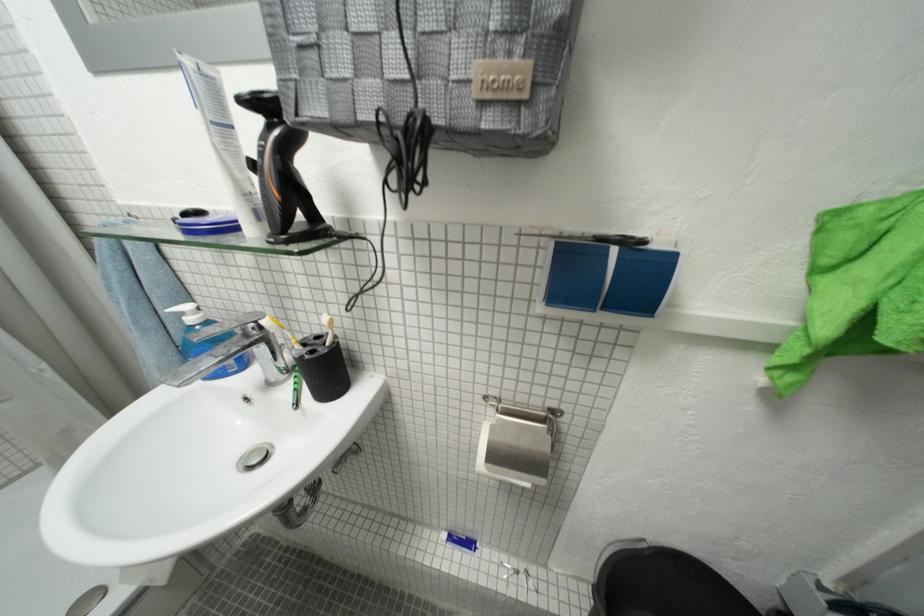
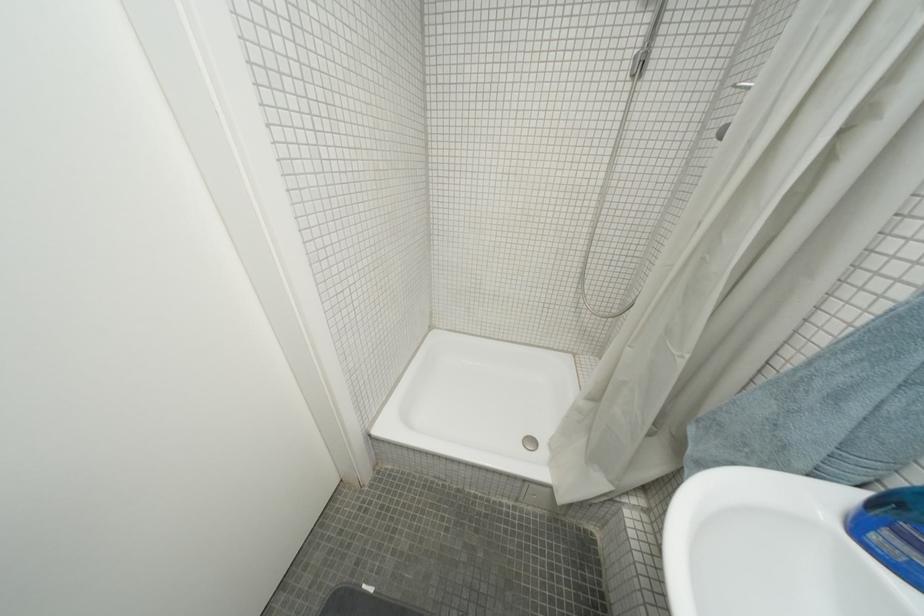
First-person continuous shooting, in which direction is the camera rotating?

The camera rotated toward left-down.